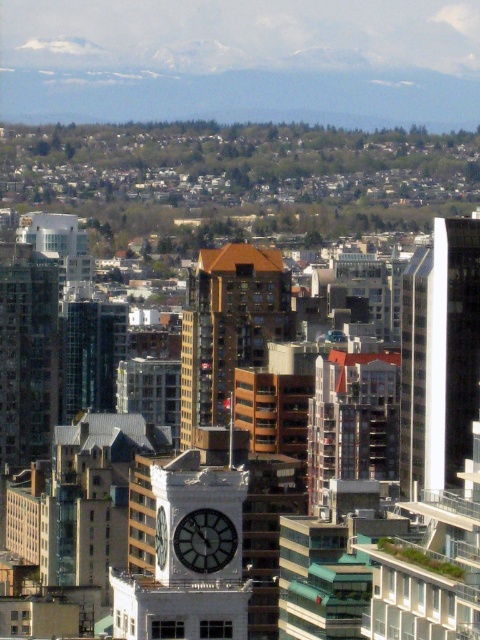
Question: Does brown wood grain building at center have a larger size compared to black glass clock at center?

Choices:
 (A) yes
 (B) no

Answer: (A)

Question: Is white glass tower at right positioned behind black glass clock at center?

Choices:
 (A) yes
 (B) no

Answer: (A)

Question: Among these objects, which one is nearest to the camera?

Choices:
 (A) brown wood grain building at center
 (B) glassy reflective skyscraper at left

Answer: (A)

Question: Which object is farther from the camera taking this photo?

Choices:
 (A) white glass tower at right
 (B) black glass clock at center
 (C) glassy reflective skyscraper at left

Answer: (C)

Question: Which point appears farthest from the camera in this image?

Choices:
 (A) (190, 532)
 (B) (472, 401)
 (C) (164, 513)
 (D) (51, 280)

Answer: (B)

Question: Is white glass tower at right bigger than black glass clock at center?

Choices:
 (A) no
 (B) yes

Answer: (B)